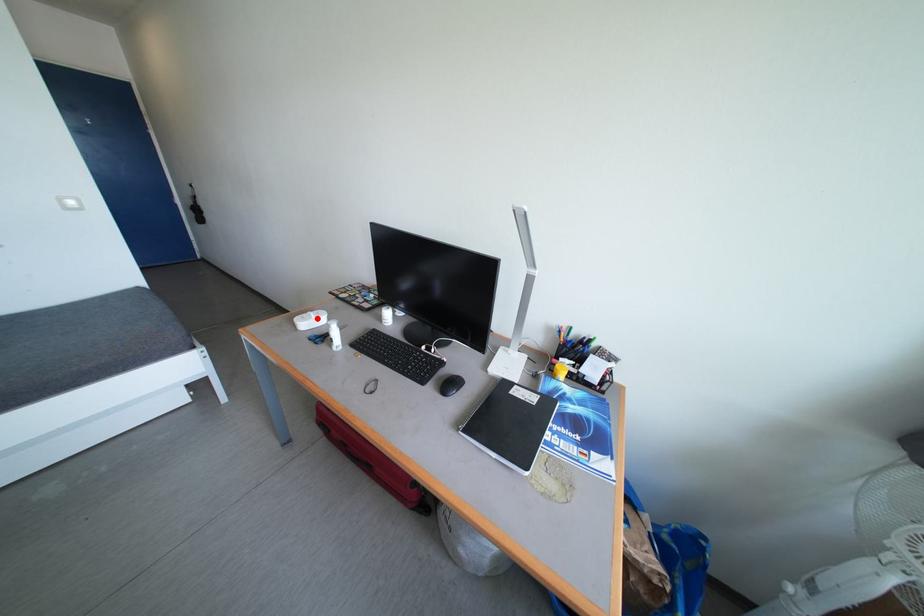
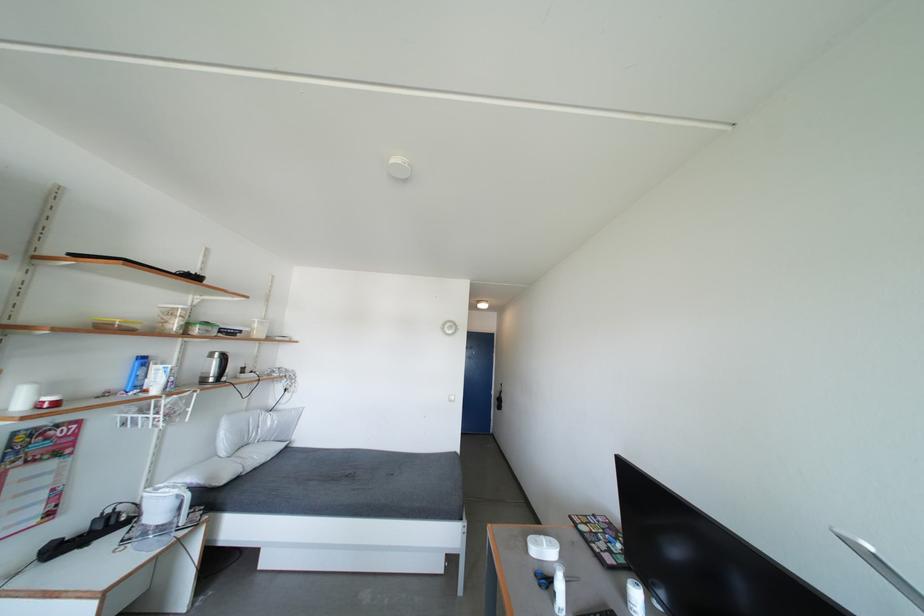
In the second image, find the point that corresponds to the highlighted location in the first image.

(550, 544)